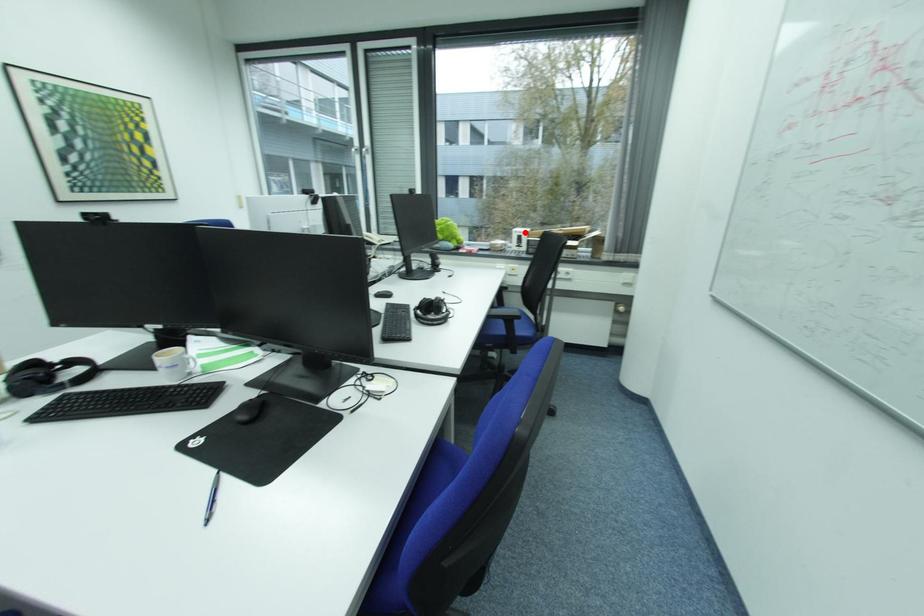
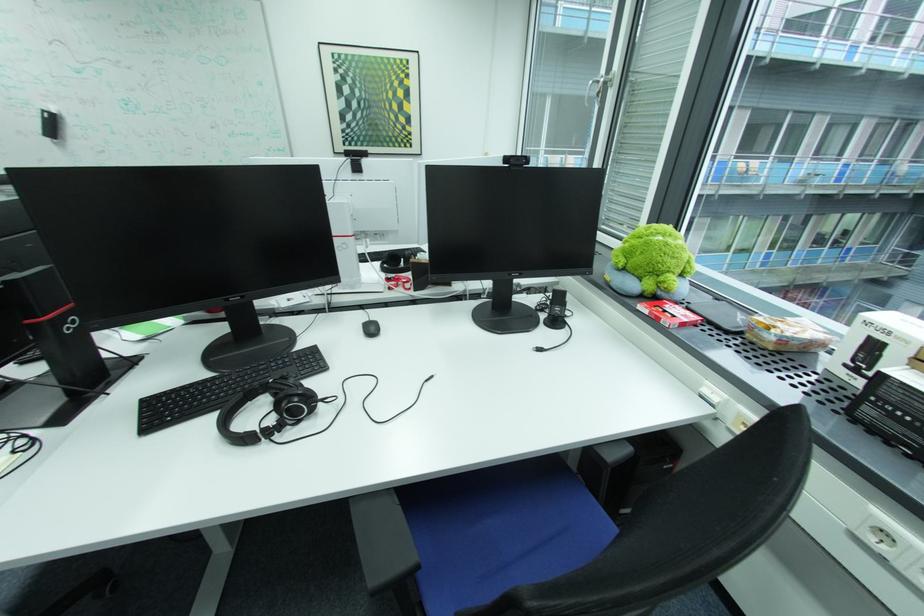
Question: I am providing you with two images of the same scene from different viewpoints. A red point is shown in image1. For the corresponding object point in image2, is it positioned nearer or farther from the camera?

Choices:
 (A) Nearer
 (B) Farther

Answer: (B)